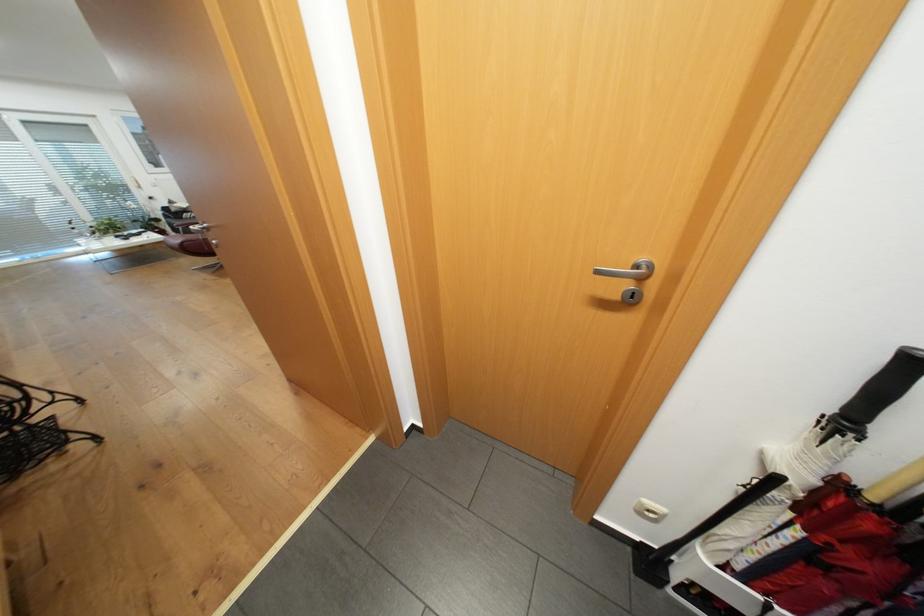
What do you see at coordinates (880, 391) in the screenshot? This screenshot has height=616, width=924. I see `a black umbrella handle` at bounding box center [880, 391].